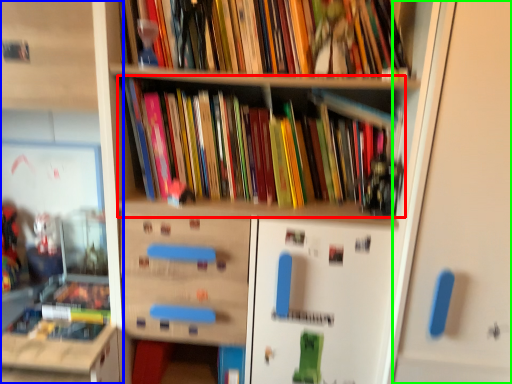
Question: Considering the real-world distances, which object is farthest from book (highlighted by a red box)? shelf (highlighted by a blue box) or door (highlighted by a green box)?

Choices:
 (A) shelf
 (B) door

Answer: (A)